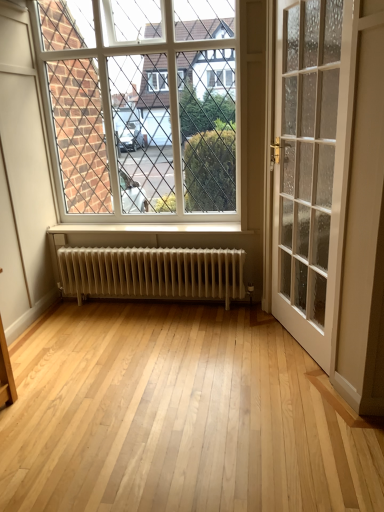
Question: From a real-world perspective, is white glass window at upper center over white glass door at right?

Choices:
 (A) no
 (B) yes

Answer: (B)

Question: Can white glass door at right be found inside white glass window at upper center?

Choices:
 (A) yes
 (B) no

Answer: (B)

Question: Does white glass window at upper center have a greater height compared to white glass door at right?

Choices:
 (A) no
 (B) yes

Answer: (A)

Question: Considering the relative sizes of white glass window at upper center and white glass door at right in the image provided, is white glass window at upper center shorter than white glass door at right?

Choices:
 (A) no
 (B) yes

Answer: (B)

Question: Is white glass window at upper center to the right of white glass door at right from the viewer's perspective?

Choices:
 (A) yes
 (B) no

Answer: (B)

Question: Considering the relative sizes of white glass window at upper center and white glass door at right in the image provided, is white glass window at upper center bigger than white glass door at right?

Choices:
 (A) yes
 (B) no

Answer: (B)

Question: Is white glass door at right aimed at white glass window at upper center?

Choices:
 (A) no
 (B) yes

Answer: (A)

Question: Can you confirm if white glass door at right is bigger than white glass window at upper center?

Choices:
 (A) yes
 (B) no

Answer: (A)

Question: Does white glass door at right have a smaller size compared to white glass window at upper center?

Choices:
 (A) no
 (B) yes

Answer: (A)

Question: Is white glass door at right taller than white glass window at upper center?

Choices:
 (A) no
 (B) yes

Answer: (B)

Question: From the image's perspective, would you say white glass door at right is shown under white glass window at upper center?

Choices:
 (A) yes
 (B) no

Answer: (A)

Question: Is white glass door at right completely or partially outside of white glass window at upper center?

Choices:
 (A) no
 (B) yes

Answer: (B)

Question: Can you confirm if white glass window at upper center is positioned to the right of white metallic radiator at center?

Choices:
 (A) no
 (B) yes

Answer: (A)